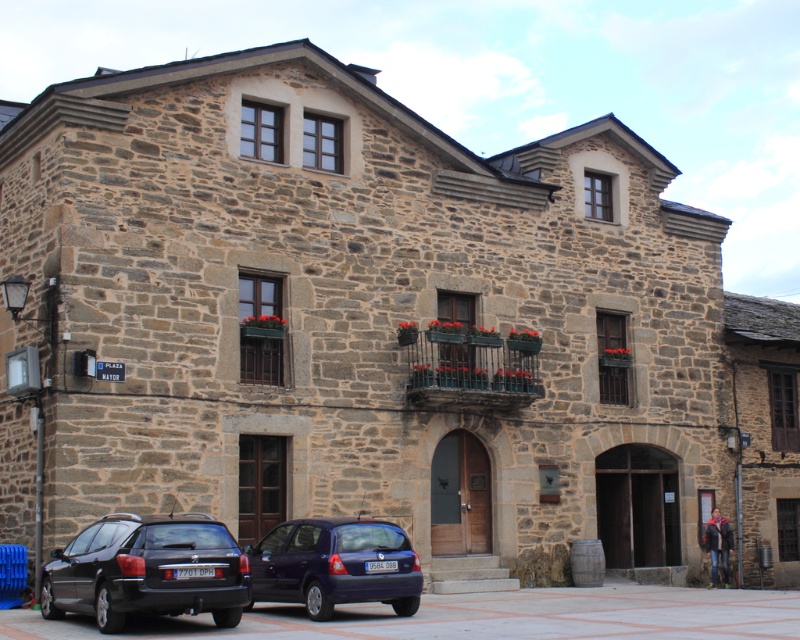
You are a delivery person trying to park your vehicle in the town square. You have a shiny black station wagon at lower left and a metallic blue hatchback at center. Which vehicle would require less vertical clearance to pass under the historic building without hitting the roof?

The shiny black station wagon at lower left has a lesser height compared to the metallic blue hatchback at center, so it would require less vertical clearance to pass under the historic building without hitting the roof.

You are driving a car that is 15 feet long. You need to park your car between the shiny black station wagon at lower left and the metallic blue hatchback at center. Is there enough space between them for your car?

The distance between the shiny black station wagon at lower left and the metallic blue hatchback at center is 19.34 feet. Since your car is 15 feet long, there is enough space between them for your car to fit.

You are a delivery person who needs to park your delivery van in the town square. The van is 6 meters long. You see the shiny black station wagon at lower left and the metallic blue hatchback at center. Can you determine if there is enough space between them to park your van?

The shiny black station wagon at lower left has a smaller size compared to metallic blue hatchback at center, but the exact distance between them is not provided. Without knowing the distance between the two vehicles, it is impossible to determine if there is enough space for the 6 meter long van.